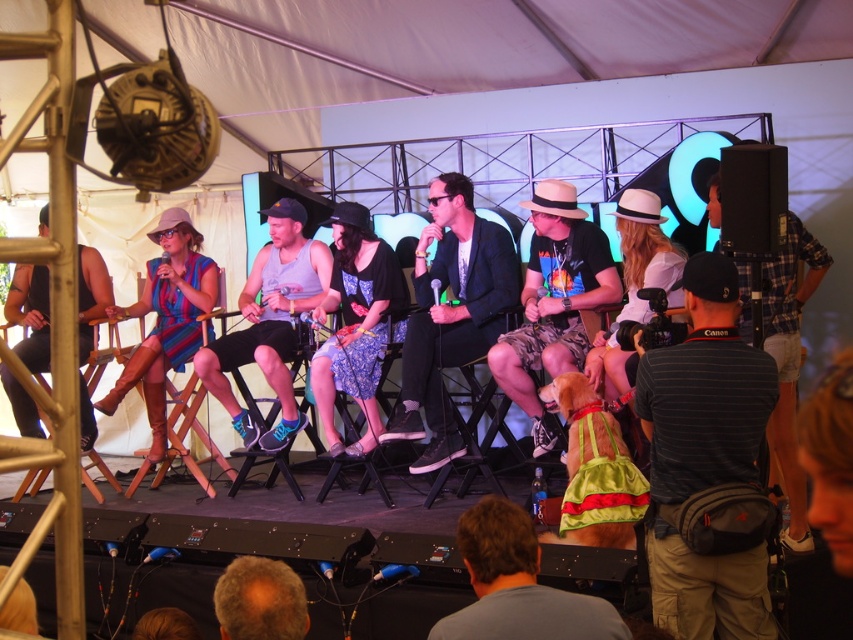
Which is more to the right, brown hair at lower center or striped fabric dress at center?

Positioned to the right is brown hair at lower center.

The image size is (853, 640). In order to click on brown hair at lower center in this screenshot , I will do `click(517, 586)`.

Between camouflage shorts at center and brown hair at lower center, which one is positioned lower?

brown hair at lower center is lower down.

Does camouflage shorts at center have a smaller size compared to brown hair at lower center?

No.

At what (x,y) coordinates should I click in order to perform the action: click on camouflage shorts at center. Please return your answer as a coordinate pair (x, y). The width and height of the screenshot is (853, 640). Looking at the image, I should click on (553, 300).

At what (x,y) coordinates should I click in order to perform the action: click on camouflage shorts at center. Please return your answer as a coordinate pair (x, y). Looking at the image, I should click on (553, 300).

Between point (709, 420) and point (647, 244), which one is positioned in front?

Point (709, 420) is in front.

Is striped cotton shirt at right below matte white hat at center?

Indeed, striped cotton shirt at right is positioned under matte white hat at center.

The width and height of the screenshot is (853, 640). What do you see at coordinates (705, 456) in the screenshot?
I see `striped cotton shirt at right` at bounding box center [705, 456].

The image size is (853, 640). What are the coordinates of `striped cotton shirt at right` in the screenshot? It's located at (705, 456).